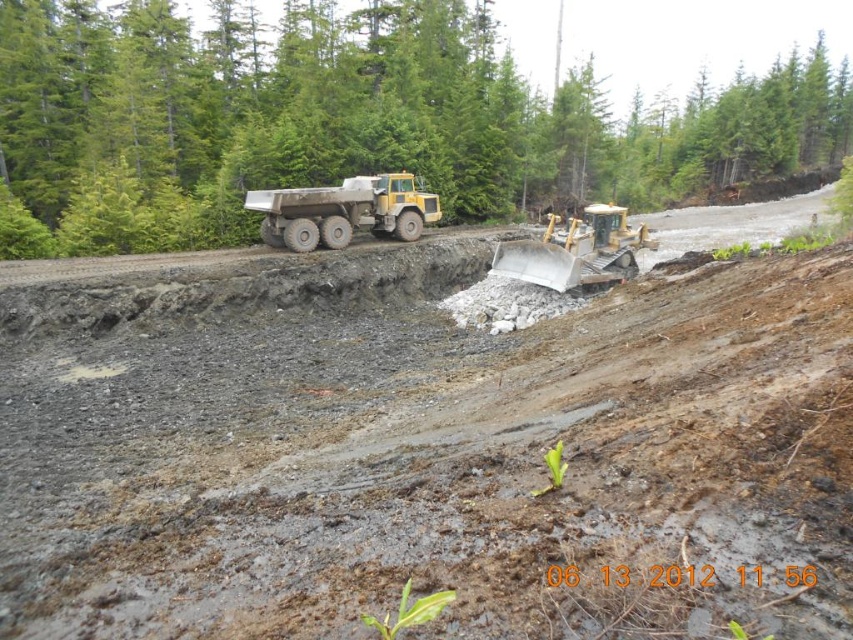
You are a construction worker trying to locate the green leafy tree at upper center. From the position of the metallic yellow excavator at center, in which direction should you look to find it?

The green leafy tree at upper center is to the right of the metallic yellow excavator at center, so you should look to the right side from the excavator to find it.

You are a safety inspector at the construction site. You need to ensure that the green leafy tree at upper center and the matte yellow truck at center are visible from the main entrance. Given their sizes, which object will appear bigger in the view from the entrance?

The green leafy tree at upper center will appear bigger in the view from the entrance because it is larger in size than the matte yellow truck at center according to the description.

You are a construction worker standing at the point marked by the coordinates point (357, 120). Which direction should you walk to reach the large yellow construction vehicle in the midground?

The large yellow construction vehicle in the midground is located to the south of the point marked by the coordinates point (357, 120), so you should walk south to reach it.